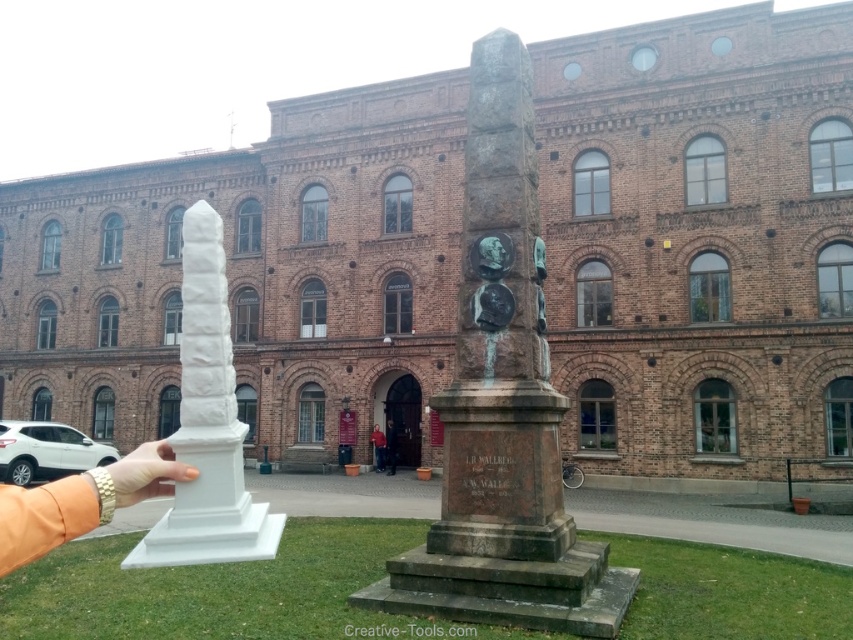
You are standing in front of the historic brick building and want to take a photo that includes both the person holding the small white obelisk and the larger stone monument. Which of the two points, point (534, 538) or point (161, 442), is closer to the camera?

Point (534, 538) is further to the camera than point (161, 442), so point (161, 442) is closer to the camera.